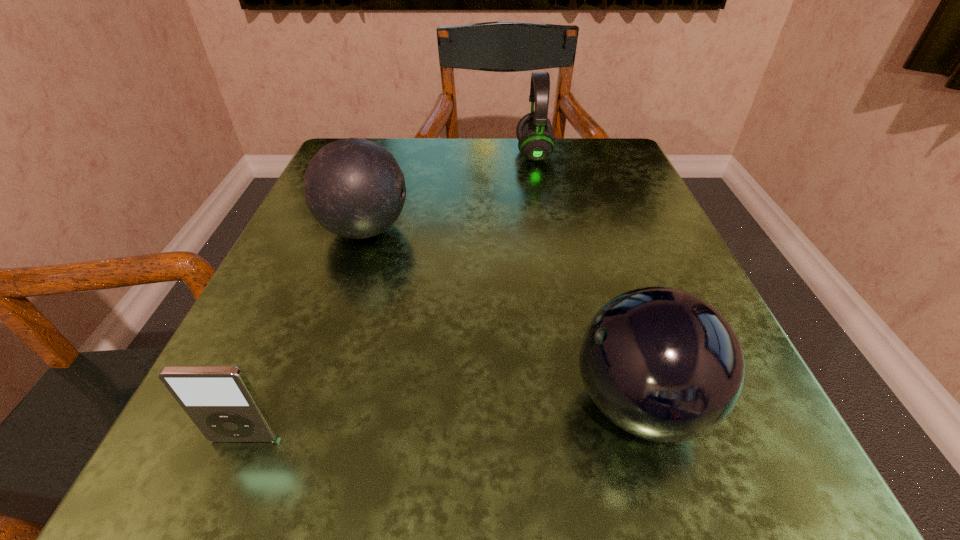
Locate an element on the screen. This screenshot has width=960, height=540. free space located on the side of the nearer bowling ball with the finger holes is located at coordinates (340, 404).

You are a GUI agent. You are given a task and a screenshot of the screen. Output one action in this format:
    pyautogui.click(x=<x>, y=<y>)
    Task: Click on the vacant area located 0.150m on the side of the nearer bowling ball with the finger holes
    
    Given the screenshot: What is the action you would take?
    pyautogui.click(x=444, y=404)

Where is `vacant space situated 0.070m on the front-facing side of the iPod`? The width and height of the screenshot is (960, 540). vacant space situated 0.070m on the front-facing side of the iPod is located at coordinates coord(213,512).

You are a GUI agent. You are given a task and a screenshot of the screen. Output one action in this format:
    pyautogui.click(x=<x>, y=<y>)
    Task: Click on the object located at the far edge
    
    Given the screenshot: What is the action you would take?
    (x=536, y=142)

At what (x,y) coordinates should I click in order to perform the action: click on bowling ball that is at the near edge. Please return your answer as a coordinate pair (x, y). The width and height of the screenshot is (960, 540). Looking at the image, I should click on (662, 364).

This screenshot has height=540, width=960. What are the coordinates of `iPod that is at the near edge` in the screenshot? It's located at (220, 400).

At what (x,y) coordinates should I click in order to perform the action: click on bowling ball located in the left edge section of the desktop. Please return your answer as a coordinate pair (x, y). The image size is (960, 540). Looking at the image, I should click on (354, 188).

This screenshot has width=960, height=540. I want to click on iPod located at the left edge, so click(x=220, y=400).

The height and width of the screenshot is (540, 960). In order to click on object located at the right edge in this screenshot , I will do `click(662, 364)`.

Find the location of a particular element. The width and height of the screenshot is (960, 540). object situated at the near left corner is located at coordinates (x=220, y=400).